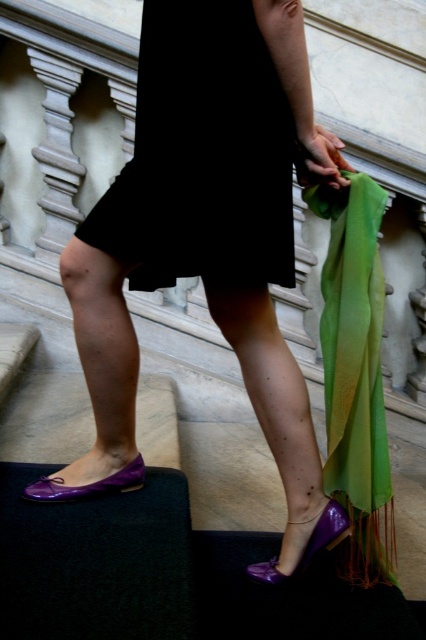
Between purple glossy shoes at lower left and purple glossy sandal at lower center, which one appears on the right side from the viewer's perspective?

From the viewer's perspective, purple glossy sandal at lower center appears more on the right side.

What do you see at coordinates (207, 225) in the screenshot?
I see `purple glossy shoes at lower left` at bounding box center [207, 225].

This screenshot has width=426, height=640. In order to click on purple glossy shoes at lower left in this screenshot , I will do 207,225.

At what (x,y) coordinates should I click in order to perform the action: click on purple glossy shoes at lower left. Please return your answer as a coordinate pair (x, y). The height and width of the screenshot is (640, 426). Looking at the image, I should click on (207, 225).

Who is taller, purple glossy shoes at lower left or green silky scarf at center?

purple glossy shoes at lower left

Which is in front, point (146, 10) or point (368, 369)?

Positioned in front is point (146, 10).

The height and width of the screenshot is (640, 426). In order to click on purple glossy shoes at lower left in this screenshot , I will do tap(207, 225).

Which is more to the right, black matte dress at center or green silky scarf at center?

green silky scarf at center

Between black matte dress at center and green silky scarf at center, which one has less height?

black matte dress at center is shorter.

Between point (250, 154) and point (333, 358), which one is positioned in front?

Positioned in front is point (250, 154).

The width and height of the screenshot is (426, 640). What are the coordinates of `black matte dress at center` in the screenshot? It's located at (203, 156).